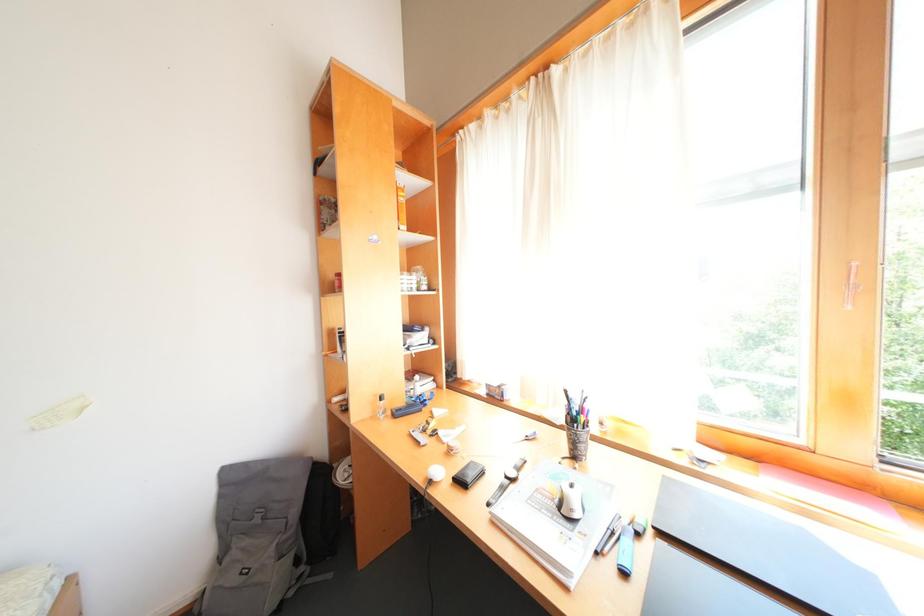
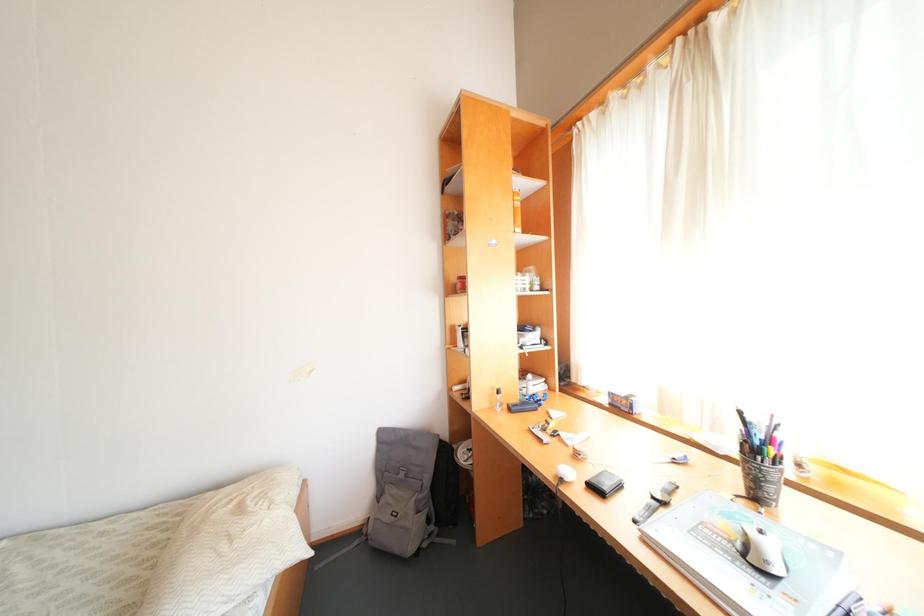
Which direction would the cameraman need to move to produce the second image?

The cameraman walked toward left, backward.